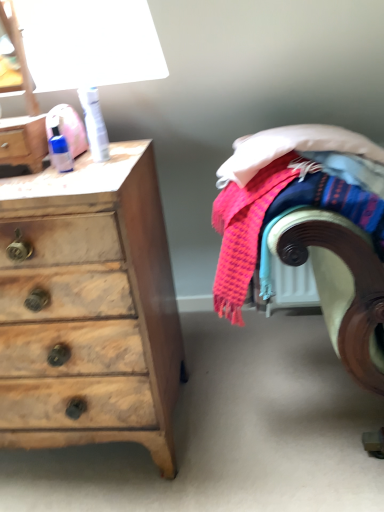
Image resolution: width=384 pixels, height=512 pixels. Identify the location of free space underneath textured woolen blanket at right (from a real-world perspective). (306, 394).